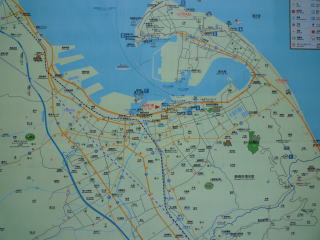
The height and width of the screenshot is (240, 320). Find the location of `map`. map is located at coordinates (153, 167).